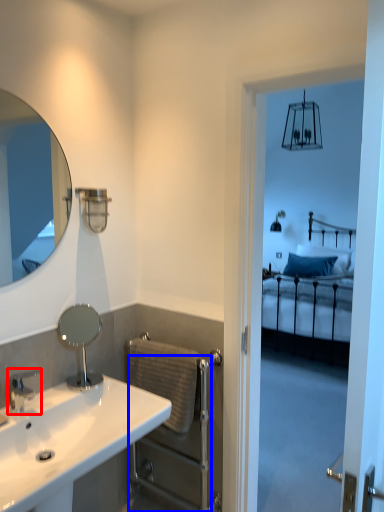
Question: Which object appears closest to the camera in this image, tap (highlighted by a red box) or balustrade (highlighted by a blue box)?

Choices:
 (A) tap
 (B) balustrade

Answer: (A)